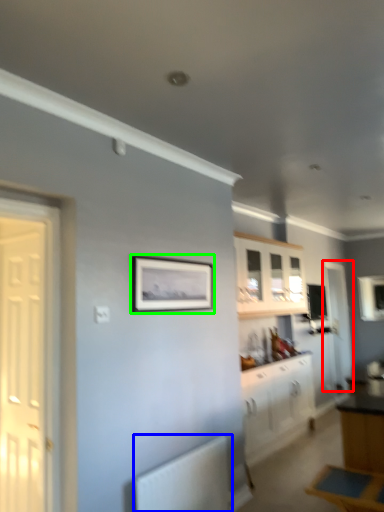
Question: Which object is positioned closest to door (highlighted by a red box)? Select from radiator (highlighted by a blue box) and picture frame (highlighted by a green box).

Choices:
 (A) radiator
 (B) picture frame

Answer: (B)